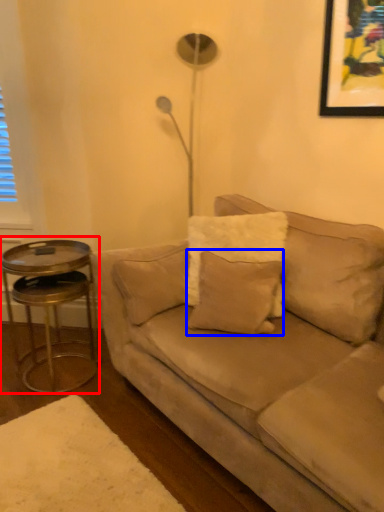
Question: Which point is closer to the camera, table (highlighted by a red box) or pillow (highlighted by a blue box)?

Choices:
 (A) table
 (B) pillow

Answer: (B)